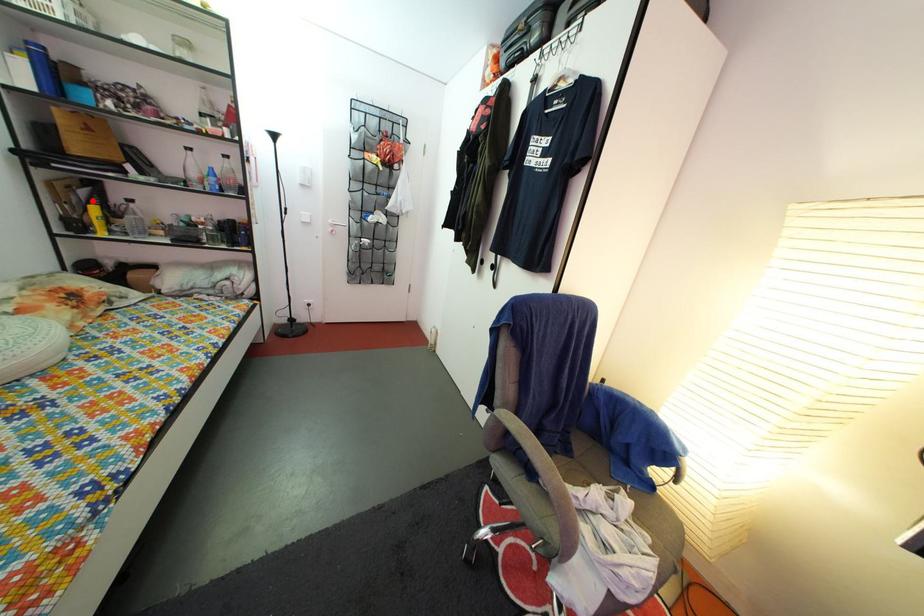
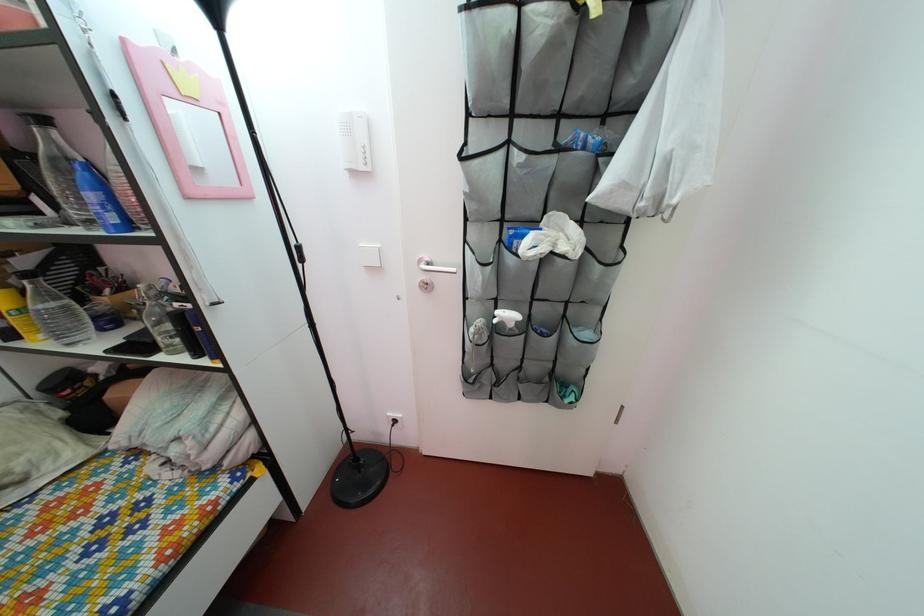
Locate, in the second image, the point that corresponds to the highlighted location in the first image.

(32, 270)